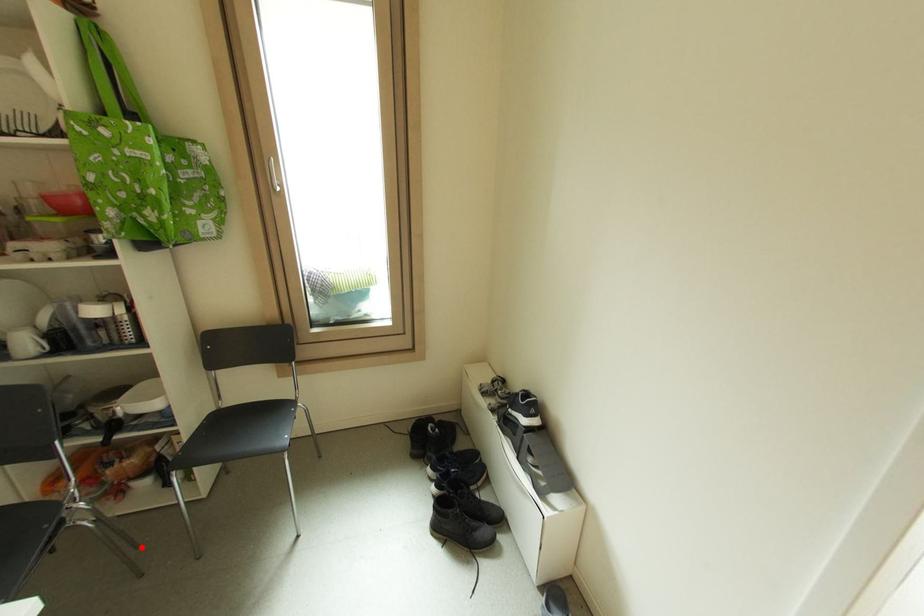
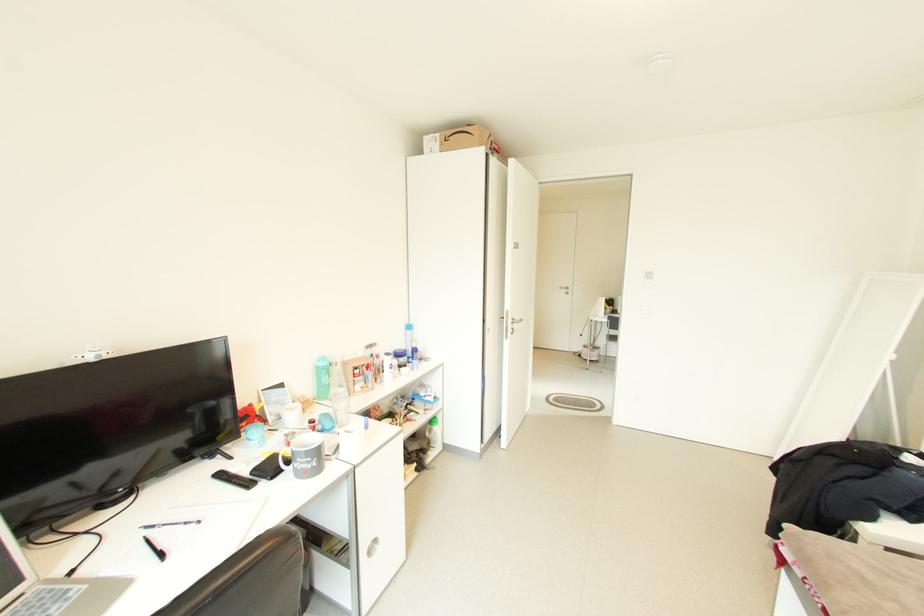
Question: I am providing you with two images of the same scene from different viewpoints. A red point is marked on the first image. At the location where the point appears in image 1, is it still visible in image 2?

Choices:
 (A) Yes
 (B) No

Answer: (B)